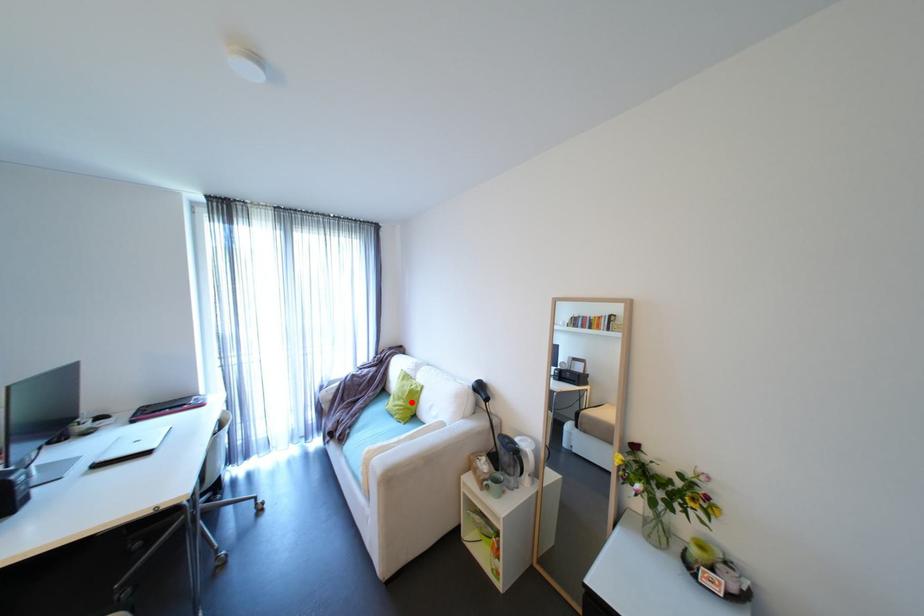
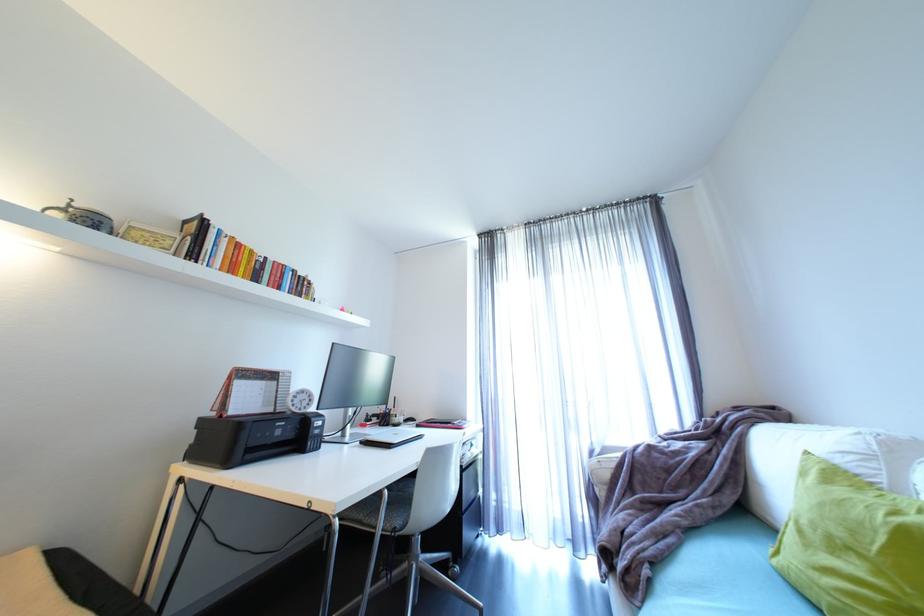
Question: I am providing you with two images of the same scene from different viewpoints. In image1, a red point is highlighted. Considering the same 3D point in image2, which of the following is correct?

Choices:
 (A) It is closer
 (B) It is farther

Answer: (A)